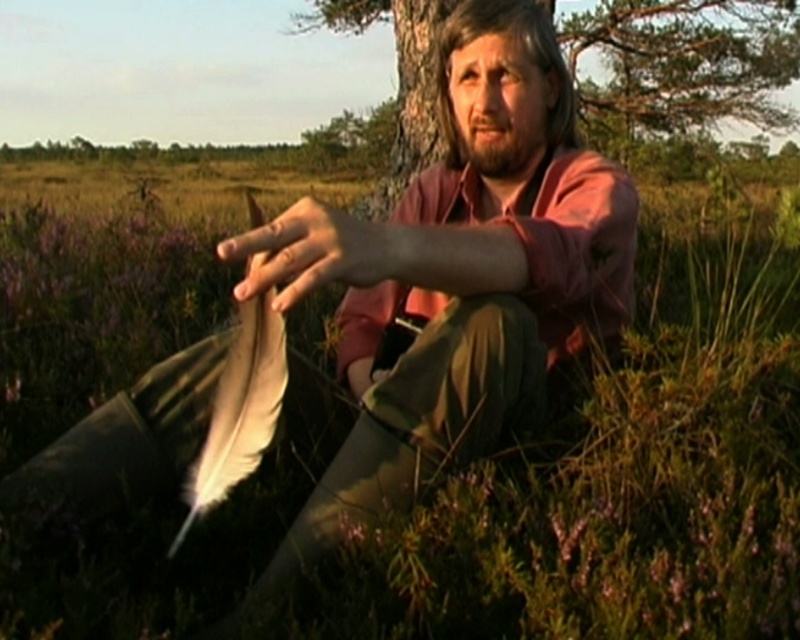
Can you confirm if matte brown feather at center is positioned to the right of brown fuzzy hair at upper center?

No, matte brown feather at center is not to the right of brown fuzzy hair at upper center.

Can you confirm if matte brown feather at center is positioned to the left of brown fuzzy hair at upper center?

Indeed, matte brown feather at center is positioned on the left side of brown fuzzy hair at upper center.

Which is in front, point (604, 205) or point (446, 147)?

Point (604, 205)

Where is `matte brown feather at center`? matte brown feather at center is located at coordinates (458, 272).

Does brown rough tree at upper center appear on the right side of white feather at center?

Indeed, brown rough tree at upper center is positioned on the right side of white feather at center.

What are the coordinates of `brown rough tree at upper center` in the screenshot? It's located at (686, 60).

At what (x,y) coordinates should I click in order to perform the action: click on brown rough tree at upper center. Please return your answer as a coordinate pair (x, y). Image resolution: width=800 pixels, height=640 pixels. Looking at the image, I should click on (686, 60).

Is white feather at center closer to camera compared to brown fuzzy hair at upper center?

Yes, white feather at center is closer to the viewer.

Describe the element at coordinates (316, 252) in the screenshot. The width and height of the screenshot is (800, 640). I see `white feather at center` at that location.

Locate an element on the screen. Image resolution: width=800 pixels, height=640 pixels. white feather at center is located at coordinates (316, 252).